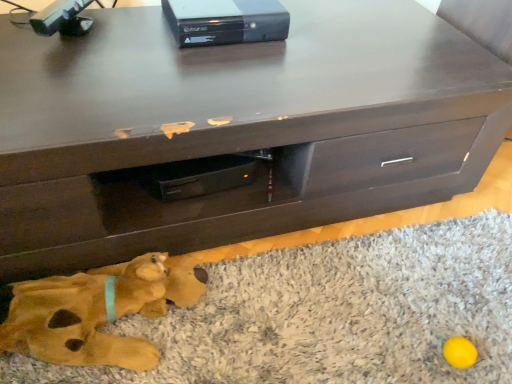
Find the location of a particular element. The image size is (512, 384). vacant region to the right of black plastic game console at upper center is located at coordinates (326, 37).